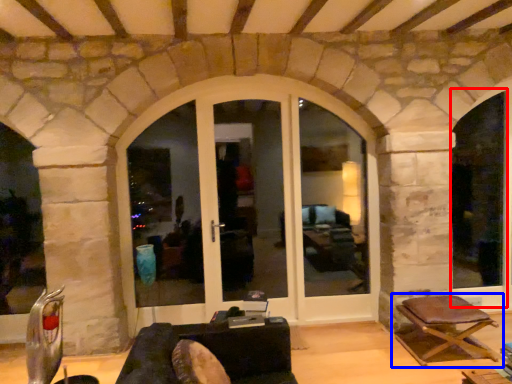
Question: Which point is closer to the camera, window frame (highlighted by a red box) or chair (highlighted by a blue box)?

Choices:
 (A) window frame
 (B) chair

Answer: (B)